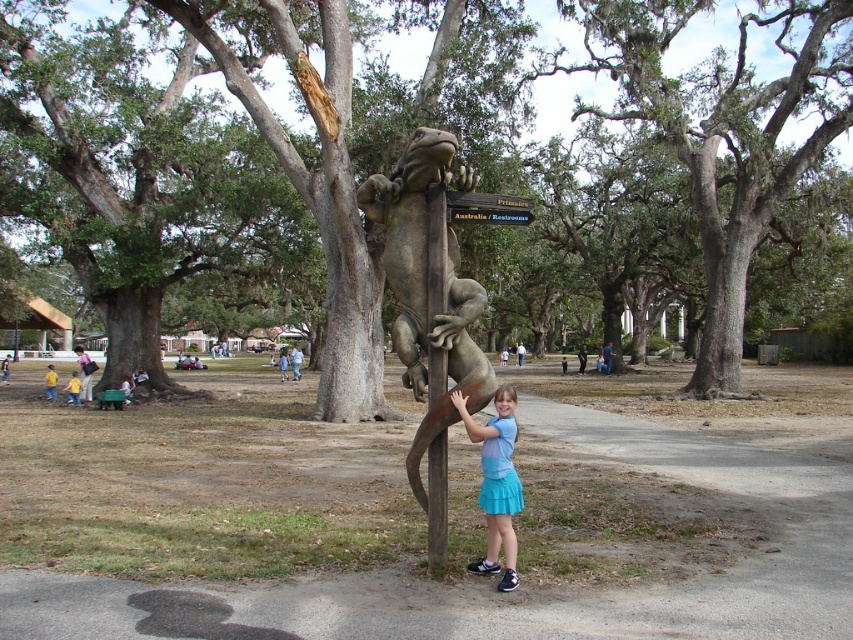
Is smooth gray lizard at center thinner than light blue fabric skirt at center?

In fact, smooth gray lizard at center might be wider than light blue fabric skirt at center.

Who is more forward, [306,17] or [467,417]?

Point [467,417] is in front.

Find the location of `smooth gray lizard at center`. smooth gray lizard at center is located at coordinates (726, 131).

Is bronze textured lizard at center to the left of wooden sign at center from the viewer's perspective?

Correct, you'll find bronze textured lizard at center to the left of wooden sign at center.

Is point (444, 547) behind point (447, 193)?

No, it is in front of (447, 193).

Locate an element on the screen. Image resolution: width=853 pixels, height=640 pixels. bronze textured lizard at center is located at coordinates (428, 305).

Is light blue fabric skirt at center taller than brown wood pole at center?

Incorrect, light blue fabric skirt at center's height is not larger of brown wood pole at center's.

This screenshot has width=853, height=640. Find the location of `light blue fabric skirt at center`. light blue fabric skirt at center is located at coordinates (496, 483).

Describe the element at coordinates (496, 483) in the screenshot. This screenshot has height=640, width=853. I see `light blue fabric skirt at center` at that location.

At what (x,y) coordinates should I click in order to perform the action: click on light blue fabric skirt at center. Please return your answer as a coordinate pair (x, y). Looking at the image, I should click on (496, 483).